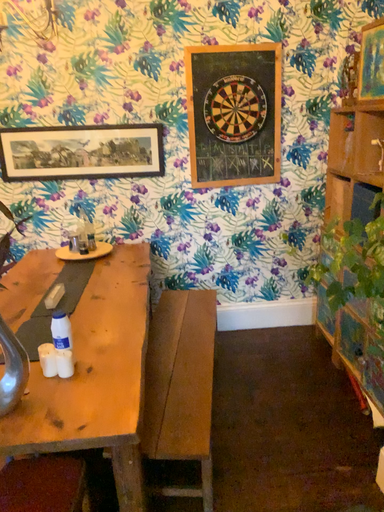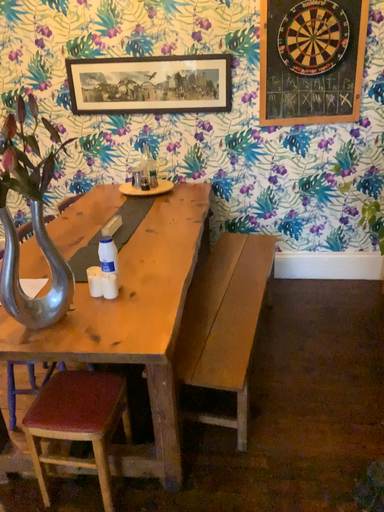
Question: Which way did the camera rotate in the video?

Choices:
 (A) rotated upward
 (B) rotated downward

Answer: (B)